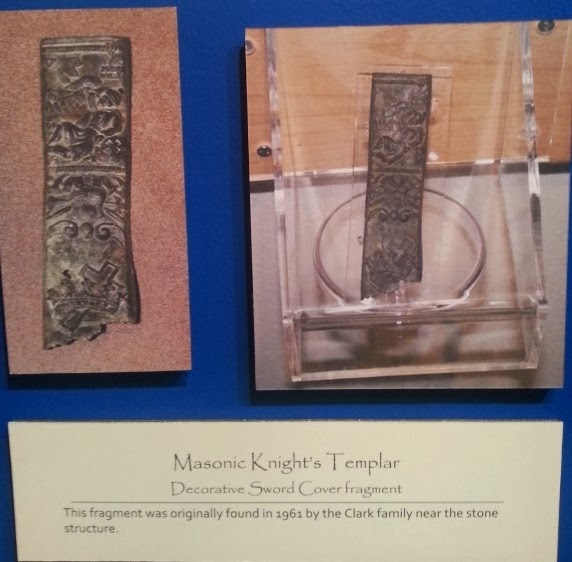
This screenshot has width=572, height=562. I want to click on hinge, so click(313, 315).